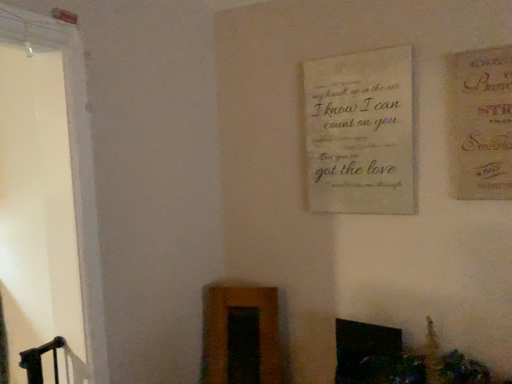
Question: Is black glossy fireplace at lower center closer to camera compared to off-white fabric plaque at center?

Choices:
 (A) no
 (B) yes

Answer: (B)

Question: From the image's perspective, does black glossy fireplace at lower center appear lower than off-white fabric plaque at center?

Choices:
 (A) yes
 (B) no

Answer: (A)

Question: From a real-world perspective, is black glossy fireplace at lower center positioned over off-white fabric plaque at center based on gravity?

Choices:
 (A) yes
 (B) no

Answer: (B)

Question: Is black glossy fireplace at lower center beside off-white fabric plaque at center?

Choices:
 (A) yes
 (B) no

Answer: (B)

Question: Is black glossy fireplace at lower center shorter than off-white fabric plaque at center?

Choices:
 (A) yes
 (B) no

Answer: (A)

Question: Considering the relative sizes of black glossy fireplace at lower center and off-white fabric plaque at center in the image provided, is black glossy fireplace at lower center wider than off-white fabric plaque at center?

Choices:
 (A) yes
 (B) no

Answer: (A)

Question: Would you say matte beige postcard at upper right is a long distance from black glossy fireplace at lower center?

Choices:
 (A) yes
 (B) no

Answer: (B)

Question: Considering the relative sizes of matte beige postcard at upper right and black glossy fireplace at lower center in the image provided, is matte beige postcard at upper right smaller than black glossy fireplace at lower center?

Choices:
 (A) yes
 (B) no

Answer: (A)

Question: Are matte beige postcard at upper right and black glossy fireplace at lower center making contact?

Choices:
 (A) no
 (B) yes

Answer: (A)

Question: Is matte beige postcard at upper right aimed at black glossy fireplace at lower center?

Choices:
 (A) yes
 (B) no

Answer: (B)

Question: Does matte beige postcard at upper right appear on the right side of black glossy fireplace at lower center?

Choices:
 (A) yes
 (B) no

Answer: (A)

Question: Is matte beige postcard at upper right behind black glossy fireplace at lower center?

Choices:
 (A) yes
 (B) no

Answer: (B)

Question: Does off-white fabric plaque at center have a larger size compared to matte beige postcard at upper right?

Choices:
 (A) no
 (B) yes

Answer: (B)